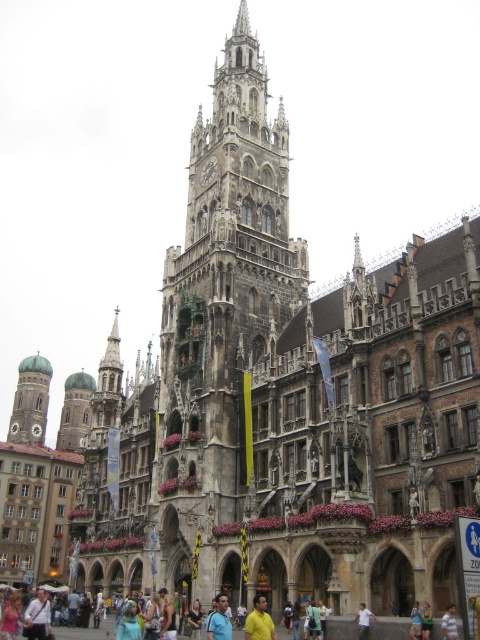
Question: Can you confirm if green stone tower at center is smaller than light blue shirt at center?

Choices:
 (A) yes
 (B) no

Answer: (B)

Question: Can you confirm if yellow cotton shirt at center is bigger than light blue shirt at center?

Choices:
 (A) yes
 (B) no

Answer: (A)

Question: Which point is closer to the camera?

Choices:
 (A) [x=72, y=380]
 (B) [x=395, y=632]
 (C) [x=245, y=621]
 (D) [x=442, y=620]

Answer: (D)

Question: Among these objects, which one is nearest to the camera?

Choices:
 (A) blue shirt at center
 (B) stone gothic tower at center
 (C) green copper dome at left
 (D) yellow cotton shirt at center

Answer: (A)

Question: Does yellow cotton shirt at center appear on the right side of blue shirt at center?

Choices:
 (A) no
 (B) yes

Answer: (A)

Question: Which object is closer to the camera taking this photo?

Choices:
 (A) light blue shirt at center
 (B) green copper dome at left

Answer: (A)